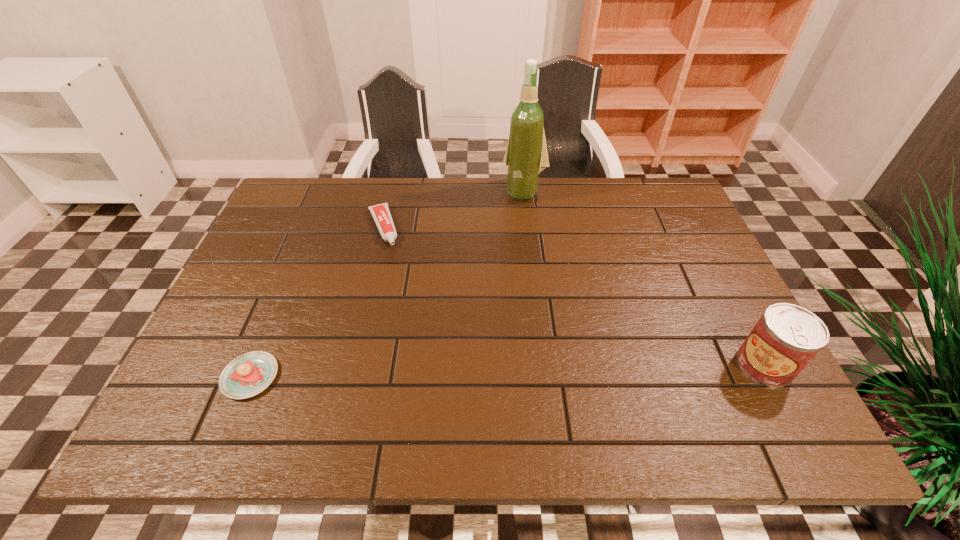
Locate an element on the screen. blank space that satisfies the following two spatial constraints: 1. on the back side of the third object from left to right; 2. on the right side of the second farthest object is located at coordinates pyautogui.click(x=392, y=191).

Image resolution: width=960 pixels, height=540 pixels. Find the location of `free location that satisfies the following two spatial constraints: 1. on the back side of the second object from right to left; 2. on the right side of the leftmost object`. free location that satisfies the following two spatial constraints: 1. on the back side of the second object from right to left; 2. on the right side of the leftmost object is located at coordinates (326, 191).

At what (x,y) coordinates should I click in order to perform the action: click on vacant point that satisfies the following two spatial constraints: 1. on the back side of the toothpaste; 2. on the left side of the farthest object. Please return your answer as a coordinate pair (x, y). The width and height of the screenshot is (960, 540). Looking at the image, I should click on (392, 191).

Locate an element on the screen. free spot that satisfies the following two spatial constraints: 1. on the back side of the leftmost object; 2. on the right side of the rightmost object is located at coordinates (255, 365).